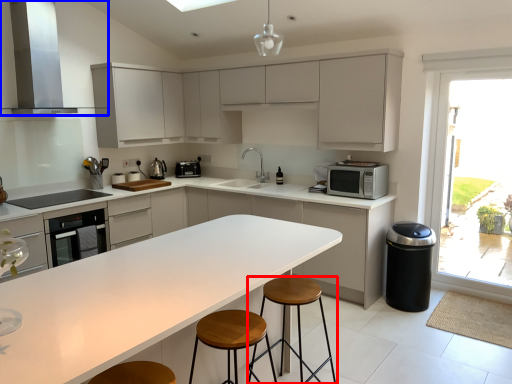
Question: Which of the following is the closest to the observer, stool (highlighted by a red box) or home appliance (highlighted by a blue box)?

Choices:
 (A) stool
 (B) home appliance

Answer: (A)